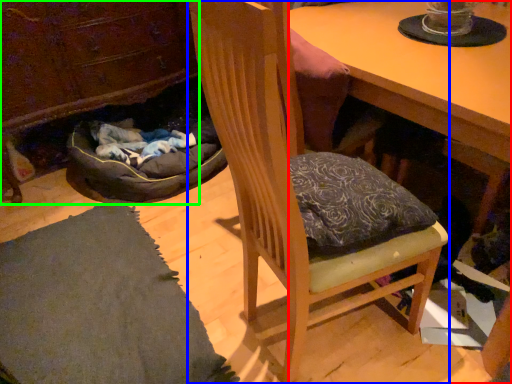
Question: Based on their relative distances, which object is nearer to desk (highlighted by a red box)? Choose from chair (highlighted by a blue box) and cabinetry (highlighted by a green box).

Choices:
 (A) chair
 (B) cabinetry

Answer: (A)